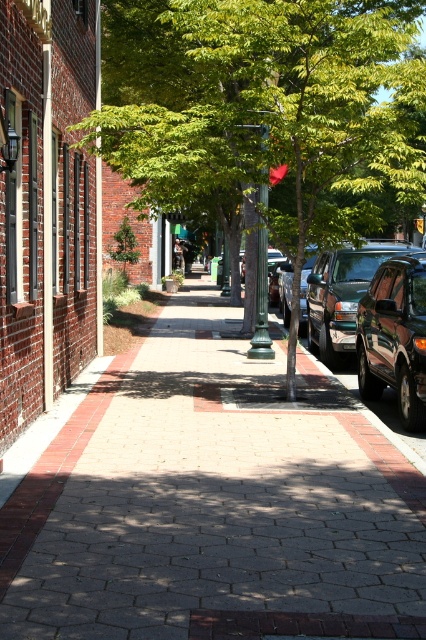
Between brick pavement at center and green leafy tree at center, which one is positioned lower?

brick pavement at center

Does point (229, 500) come behind point (377, 44)?

No, it is in front of (377, 44).

Where is `brick pavement at center`? Image resolution: width=426 pixels, height=640 pixels. brick pavement at center is located at coordinates (209, 500).

Can you confirm if green leafy tree at center is positioned below shiny dark green suv at right?

No, green leafy tree at center is not below shiny dark green suv at right.

Who is taller, green leafy tree at center or shiny dark green suv at right?

green leafy tree at center

The width and height of the screenshot is (426, 640). What do you see at coordinates (264, 109) in the screenshot? I see `green leafy tree at center` at bounding box center [264, 109].

Where is `green leafy tree at center`? This screenshot has width=426, height=640. green leafy tree at center is located at coordinates (264, 109).

Does brick pavement at center appear under shiny dark green suv at right?

Yes.

Which is behind, point (190, 492) or point (317, 289)?

Positioned behind is point (317, 289).

You are a GUI agent. You are given a task and a screenshot of the screen. Output one action in this format:
    pyautogui.click(x=<x>, y=<y>)
    Task: Click on the brick pavement at center
    The width and height of the screenshot is (426, 640).
    Given the screenshot: What is the action you would take?
    tap(209, 500)